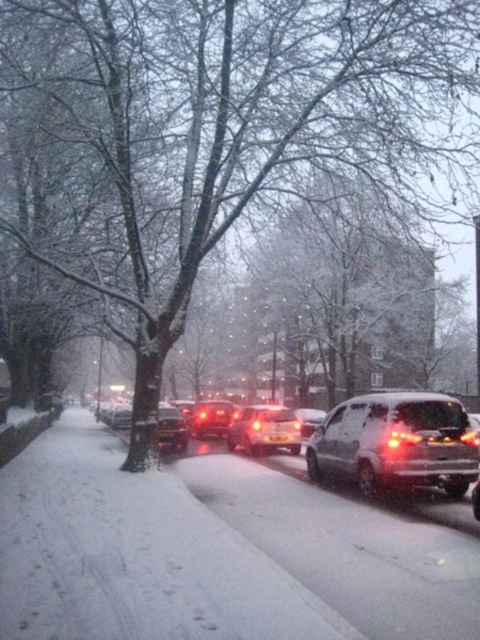
Question: Which point is farther to the camera?

Choices:
 (A) black plastic license plate at center
 (B) shiny black sedan at center

Answer: (B)

Question: Which is farther from the matte red car at center?

Choices:
 (A) sleek silver van at center
 (B) shiny black sedan at center

Answer: (A)

Question: Which point is closer to the camera?

Choices:
 (A) (309, 412)
 (B) (380, 474)
 (C) (280, 433)
 (D) (286, 412)

Answer: (B)

Question: Does matte silver car at center have a greater width compared to sleek silver sedan at center?

Choices:
 (A) yes
 (B) no

Answer: (B)

Question: Does sleek silver van at center appear under sleek silver sedan at center?

Choices:
 (A) yes
 (B) no

Answer: (B)

Question: Is sleek silver van at center wider than matte silver car at center?

Choices:
 (A) yes
 (B) no

Answer: (A)